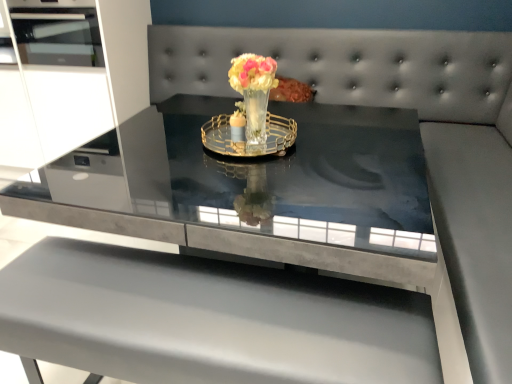
Question: Does gold metallic tray at center have a lesser height compared to matte gray table at center?

Choices:
 (A) no
 (B) yes

Answer: (B)

Question: Can you confirm if gold metallic tray at center is thinner than matte gray table at center?

Choices:
 (A) no
 (B) yes

Answer: (B)

Question: From the image's perspective, is gold metallic tray at center under matte gray table at center?

Choices:
 (A) no
 (B) yes

Answer: (A)

Question: Is gold metallic tray at center placed right next to matte gray table at center?

Choices:
 (A) yes
 (B) no

Answer: (B)

Question: Would you say gold metallic tray at center is a long distance from matte gray table at center?

Choices:
 (A) yes
 (B) no

Answer: (B)

Question: Is point (113, 319) positioned closer to the camera than point (290, 119)?

Choices:
 (A) closer
 (B) farther

Answer: (A)

Question: From the image's perspective, relative to translucent glass vase at center, is matte gray table at center above or below?

Choices:
 (A) above
 (B) below

Answer: (B)

Question: Would you say matte gray table at center is to the left or to the right of translucent glass vase at center in the picture?

Choices:
 (A) right
 (B) left

Answer: (B)

Question: Is matte gray table at center wider or thinner than translucent glass vase at center?

Choices:
 (A) thin
 (B) wide

Answer: (B)

Question: Considering the positions of smooth gray couch at center and matte gray table at center in the image, is smooth gray couch at center bigger or smaller than matte gray table at center?

Choices:
 (A) big
 (B) small

Answer: (A)

Question: Considering the positions of smooth gray couch at center and matte gray table at center in the image, is smooth gray couch at center wider or thinner than matte gray table at center?

Choices:
 (A) wide
 (B) thin

Answer: (A)

Question: Does point (428, 87) appear closer or farther from the camera than point (248, 380)?

Choices:
 (A) farther
 (B) closer

Answer: (A)

Question: Do you think smooth gray couch at center is within matte gray table at center, or outside of it?

Choices:
 (A) outside
 (B) inside

Answer: (A)

Question: Is gold metallic tray at center in front of or behind smooth gray couch at center in the image?

Choices:
 (A) front
 (B) behind

Answer: (B)

Question: Considering the positions of gold metallic tray at center and smooth gray couch at center in the image, is gold metallic tray at center bigger or smaller than smooth gray couch at center?

Choices:
 (A) small
 (B) big

Answer: (A)